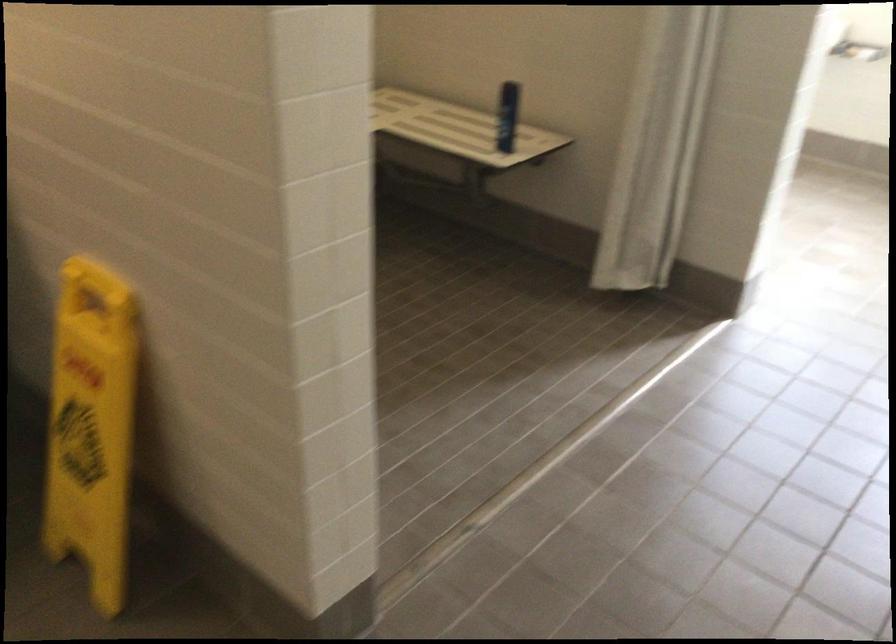
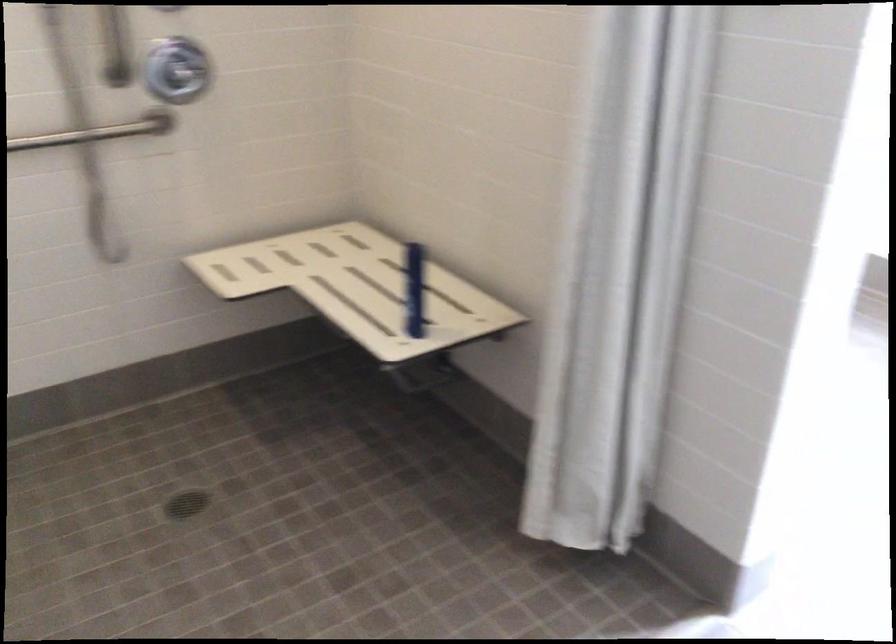
Locate, in the second image, the point that corresponds to point 510,116 in the first image.

(414, 289)